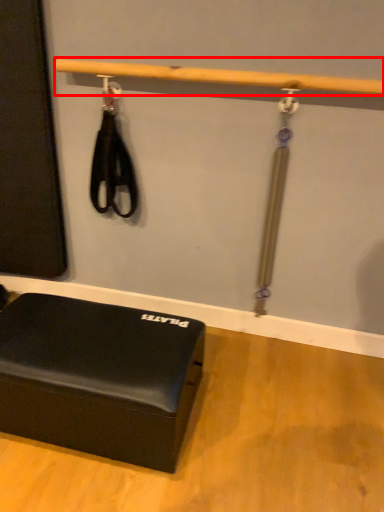
Question: In this image, where is beam (annotated by the red box) located relative to furniture?

Choices:
 (A) left
 (B) right

Answer: (B)